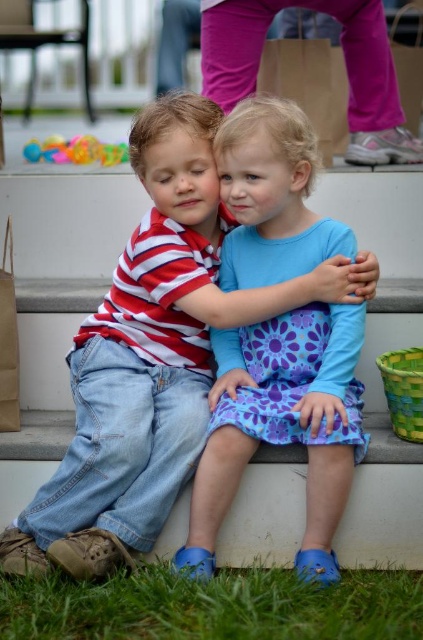
Question: Observing the image, what is the correct spatial positioning of blue cotton dress at center in reference to green grass at lower center?

Choices:
 (A) above
 (B) below

Answer: (A)

Question: Which object is positioned farthest from the green grass at lower center?

Choices:
 (A) pink fabric pants at upper center
 (B) translucent plastic toys at upper left
 (C) blue cotton dress at center

Answer: (B)

Question: Does blue cotton dress at center appear on the left side of pink fabric pants at upper center?

Choices:
 (A) yes
 (B) no

Answer: (A)

Question: Is pink fabric pants at upper center to the right of translucent plastic toys at upper left from the viewer's perspective?

Choices:
 (A) no
 (B) yes

Answer: (B)

Question: Which point is closer to the camera taking this photo?

Choices:
 (A) (79, 138)
 (B) (362, 442)
 (C) (246, 10)

Answer: (B)

Question: Which of these objects is positioned closest to the green grass at lower center?

Choices:
 (A) pink fabric pants at upper center
 (B) translucent plastic toys at upper left

Answer: (A)